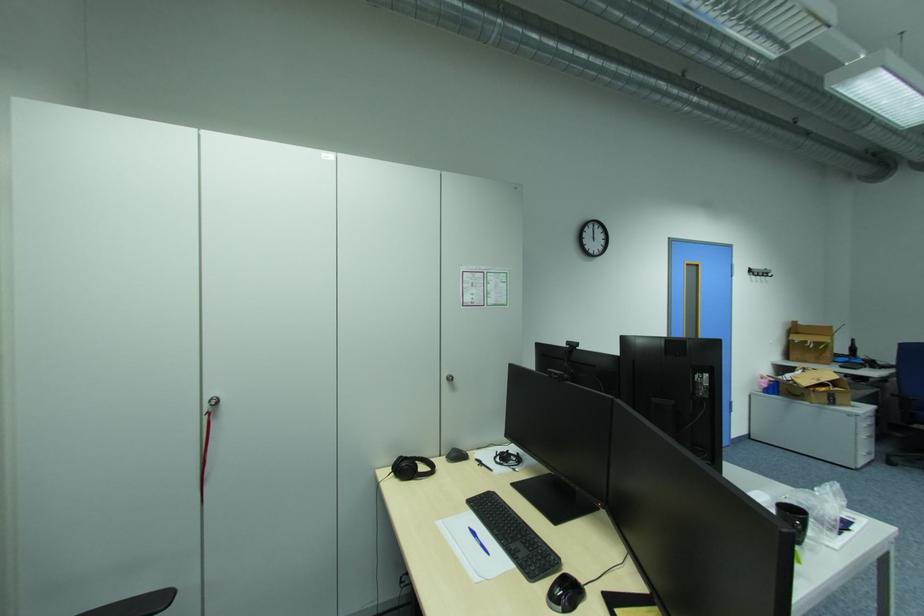
You are a GUI agent. You are given a task and a screenshot of the screen. Output one action in this format:
    pyautogui.click(x=<x>, y=<y>)
    Task: Click on the cardboard box
    The image size is (924, 616).
    Given the screenshot: What is the action you would take?
    pyautogui.click(x=809, y=342)